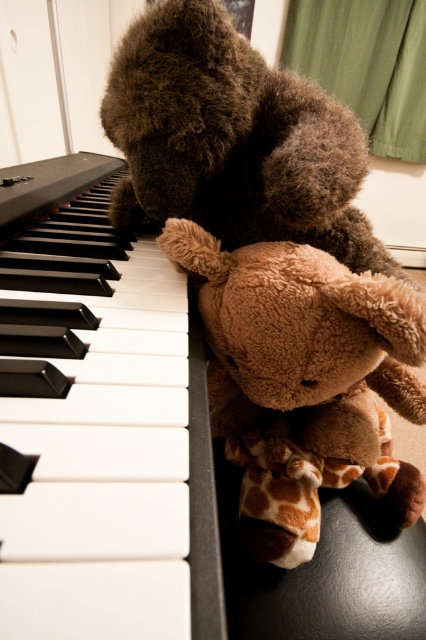
Please describe the location of the black matte piano keys at left in terms of coordinates. The coordinate system has the origin at the bottom left corner of the image, with x increasing to the right and y increasing upward. The image has a width of 1.0 and height of 1.0. Please provide the coordinates as a tuple of two decimal numbers rounded to three decimal places.

The black matte piano keys at left are located at coordinates approximately at point (100,426).

You are arranging a piano performance and need to place a 15 cm wide music stand between the black matte piano keys at left and the brown plush teddy bear at center. Will the music stand fit between them?

The black matte piano keys at left is bigger than brown plush teddy bear at center, so the space between them may be sufficient to accommodate the 15 cm wide music stand. However, the exact fit depends on the distance between the two objects, which isn